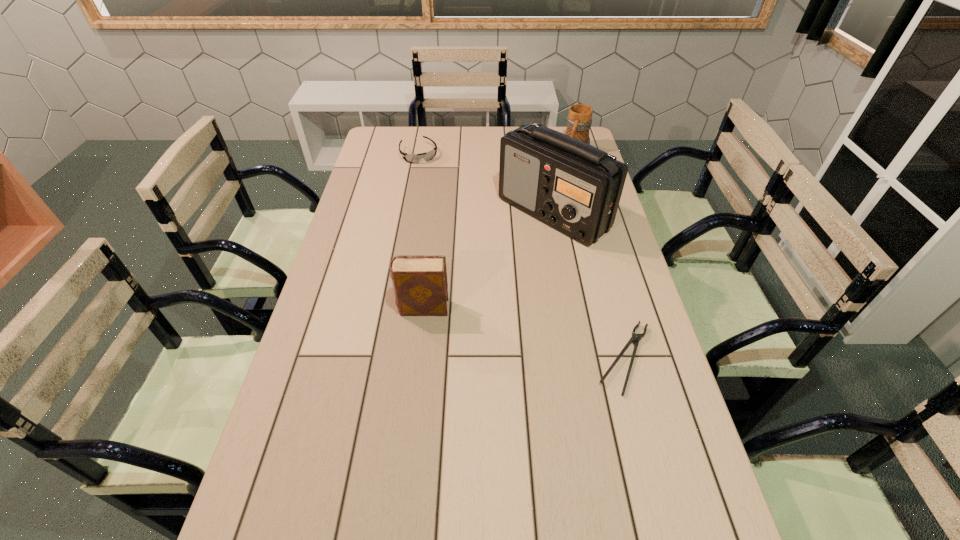
The height and width of the screenshot is (540, 960). I want to click on the second nearest object, so click(x=420, y=285).

Image resolution: width=960 pixels, height=540 pixels. I want to click on tongs, so click(635, 338).

The height and width of the screenshot is (540, 960). I want to click on the nearest object, so click(635, 338).

This screenshot has height=540, width=960. Identify the location of radio receiver. click(574, 187).

Locate an element on the screen. This screenshot has height=540, width=960. the third nearest object is located at coordinates (574, 187).

The width and height of the screenshot is (960, 540). In order to click on mug in this screenshot , I will do `click(579, 120)`.

Where is `sunglasses`? This screenshot has width=960, height=540. sunglasses is located at coordinates (427, 156).

This screenshot has width=960, height=540. I want to click on vacant space located 0.060m on the spine side of the diary, so click(x=376, y=308).

The height and width of the screenshot is (540, 960). What are the coordinates of `free spot located 0.070m on the spine side of the diary` in the screenshot? It's located at (372, 308).

Locate an element on the screen. The width and height of the screenshot is (960, 540). blank area located 0.150m on the spine side of the diary is located at coordinates (345, 308).